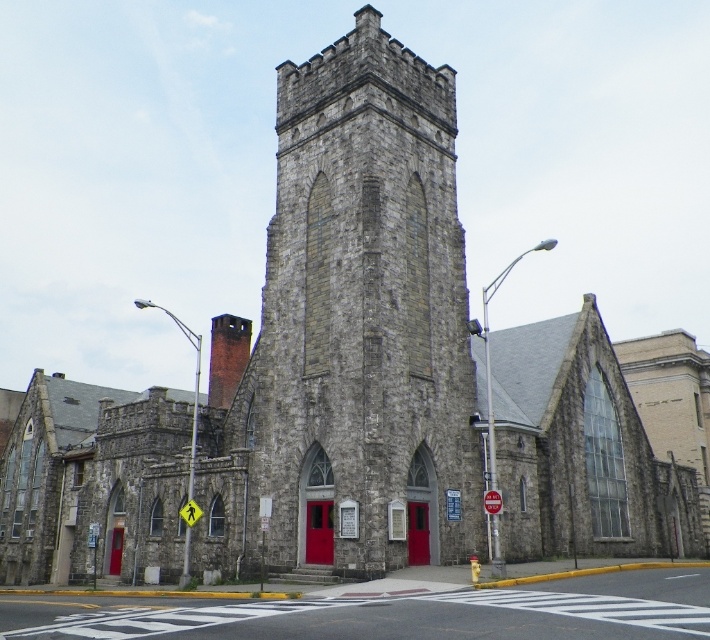
From the picture: Who is more forward, (395, 396) or (635, 604)?

Point (635, 604)

Between point (290, 288) and point (611, 609), which one is positioned behind?

The point (290, 288) is more distant.

Find the location of a particular element. Image resolution: width=710 pixels, height=640 pixels. gray stone tower at center is located at coordinates (361, 321).

Locate an element on the screen. gray stone tower at center is located at coordinates (361, 321).